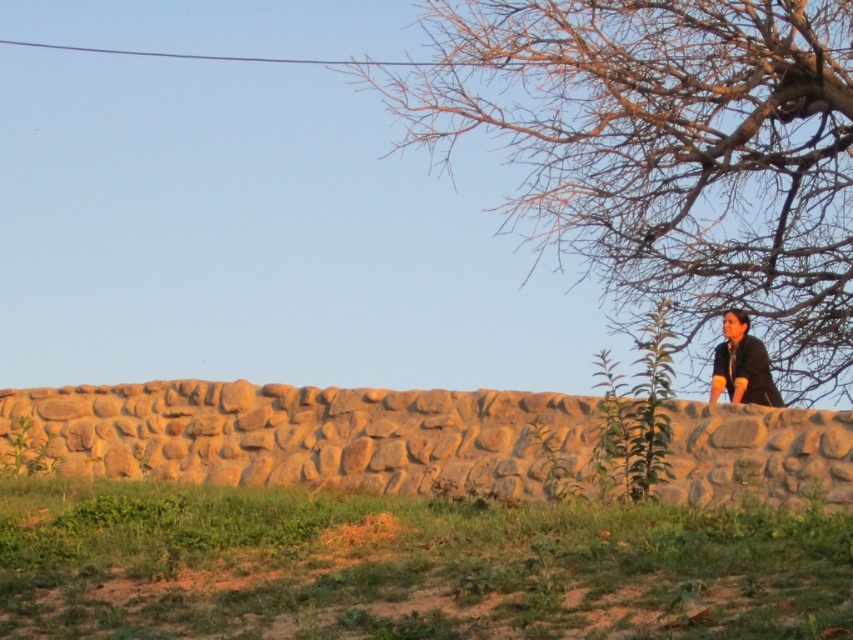
You are standing in the middle of the grassy area in the scene. You want to take a photo of the rustic stone wall at center without the brown textured tree at upper right blocking the view. Is it possible to do so?

The brown textured tree at upper right is much taller than the rustic stone wall at center, so it might block the view. However, since the tree is at the upper right, you can position yourself to the left side of the scene to frame the rustic stone wall at center without the tree obstructing the view.